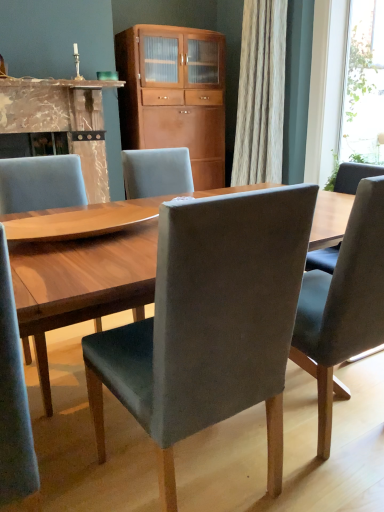
Question: From a real-world perspective, is matte gray chair at center, the 1th chair from the left, physically above velvet grey chair at center, placed as the 2th chair when sorted from right to left?

Choices:
 (A) yes
 (B) no

Answer: (A)

Question: Is matte gray chair at center, the 1th chair from the left, oriented towards velvet grey chair at center, which is the 2th chair from left to right?

Choices:
 (A) yes
 (B) no

Answer: (A)

Question: Considering the relative sizes of matte gray chair at center, the third chair in the right-to-left sequence, and velvet grey chair at center, which is the 2th chair from left to right, in the image provided, is matte gray chair at center, the third chair in the right-to-left sequence, smaller than velvet grey chair at center, which is the 2th chair from left to right,?

Choices:
 (A) no
 (B) yes

Answer: (A)

Question: Can you confirm if matte gray chair at center, the third chair in the right-to-left sequence, is thinner than velvet grey chair at center, placed as the 2th chair when sorted from right to left?

Choices:
 (A) yes
 (B) no

Answer: (B)

Question: Could velvet grey chair at center, which is the 2th chair from left to right, be considered to be inside matte gray chair at center, the 1th chair from the left?

Choices:
 (A) no
 (B) yes

Answer: (A)

Question: Is matte gray chair at center, the 1th chair from the left, in contact with velvet grey chair at center, which is the 2th chair from left to right?

Choices:
 (A) no
 (B) yes

Answer: (A)

Question: Is the depth of velvet grey chair at center, placed as the 2th chair when sorted from right to left, less than that of transparent glass window at upper right?

Choices:
 (A) no
 (B) yes

Answer: (B)

Question: From a real-world perspective, is velvet grey chair at center, which is the 2th chair from left to right, located beneath transparent glass window at upper right?

Choices:
 (A) no
 (B) yes

Answer: (B)

Question: From the image's perspective, is velvet grey chair at center, which is the 2th chair from left to right, above transparent glass window at upper right?

Choices:
 (A) yes
 (B) no

Answer: (B)

Question: Is the surface of velvet grey chair at center, placed as the 2th chair when sorted from right to left, in direct contact with transparent glass window at upper right?

Choices:
 (A) yes
 (B) no

Answer: (B)

Question: Can you confirm if velvet grey chair at center, placed as the 2th chair when sorted from right to left, is wider than transparent glass window at upper right?

Choices:
 (A) yes
 (B) no

Answer: (A)

Question: Is velvet grey chair at center, which is the 2th chair from left to right, facing away from transparent glass window at upper right?

Choices:
 (A) yes
 (B) no

Answer: (B)

Question: Would you say velvet grey chair at center, placed as the 2th chair when sorted from right to left, contains wooden cabinet at center?

Choices:
 (A) no
 (B) yes

Answer: (A)